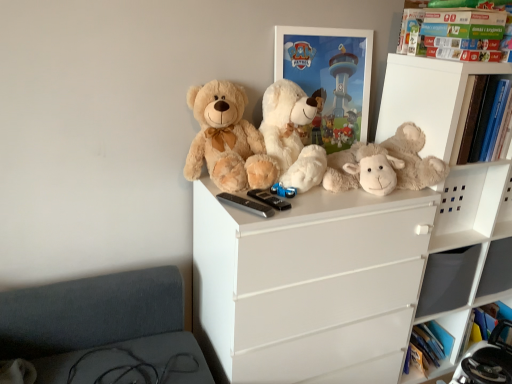
What do you see at coordinates (291, 135) in the screenshot? Image resolution: width=512 pixels, height=384 pixels. I see `fluffy white teddy bear at upper center, which is the second teddy bear in left-to-right order` at bounding box center [291, 135].

Describe the element at coordinates (449, 24) in the screenshot. I see `green cardboard book at upper right` at that location.

Describe the element at coordinates (329, 78) in the screenshot. I see `white glossy picture frame at upper center` at that location.

What is the approximate height of fluffy beige teddy bear at center, placed as the 1th teddy bear when sorted from right to left?

9.05 inches.

In order to click on white matte shelf at upper right in this screenshot , I will do click(426, 98).

The width and height of the screenshot is (512, 384). Identify the location of fluffy white teddy bear at upper center, the 2th teddy bear positioned from the right. (291, 135).

Who is bigger, fluffy beige teddy bear at center, marked as the 3th teddy bear in a left-to-right arrangement, or green cardboard book at upper right?

With larger size is fluffy beige teddy bear at center, marked as the 3th teddy bear in a left-to-right arrangement.

How far apart are fluffy beige teddy bear at center, placed as the 1th teddy bear when sorted from right to left, and green cardboard book at upper right?

16.93 inches.

Can we say fluffy beige teddy bear at center, marked as the 3th teddy bear in a left-to-right arrangement, lies outside green cardboard book at upper right?

fluffy beige teddy bear at center, marked as the 3th teddy bear in a left-to-right arrangement, lies outside green cardboard book at upper right's area.

How many degrees apart are the facing directions of fluffy beige teddy bear at center, marked as the 3th teddy bear in a left-to-right arrangement, and green cardboard book at upper right?

They differ by 1.41 degrees in their facing directions.

Which is farther from the camera, (269, 151) or (384, 85)?

The point (384, 85) is farther from the camera.

From their relative heights in the image, would you say fluffy white teddy bear at upper center, the 2th teddy bear positioned from the right, is taller or shorter than white matte shelf at upper right?

fluffy white teddy bear at upper center, the 2th teddy bear positioned from the right, is taller than white matte shelf at upper right.

From the image's perspective, is fluffy white teddy bear at upper center, which is the second teddy bear in left-to-right order, below white matte shelf at upper right?

Yes, from the image's perspective, fluffy white teddy bear at upper center, which is the second teddy bear in left-to-right order, is beneath white matte shelf at upper right.

Does fluffy white teddy bear at upper center, which is the second teddy bear in left-to-right order, have a lesser width compared to white matte shelf at upper right?

Correct, the width of fluffy white teddy bear at upper center, which is the second teddy bear in left-to-right order, is less than that of white matte shelf at upper right.

This screenshot has width=512, height=384. I want to click on picture frame on the left side of green cardboard book at upper right, so click(329, 78).

Considering the sizes of white glossy picture frame at upper center and green cardboard book at upper right in the image, is white glossy picture frame at upper center wider or thinner than green cardboard book at upper right?

Considering their sizes, white glossy picture frame at upper center looks slimmer than green cardboard book at upper right.

Which of these two, white glossy picture frame at upper center or green cardboard book at upper right, stands shorter?

Standing shorter between the two is green cardboard book at upper right.

From a real-world perspective, which is physically above, white glossy picture frame at upper center or green cardboard book at upper right?

In real-world perspective, green cardboard book at upper right is above.

Is white glossy picture frame at upper center positioned in front of fluffy beige teddy bear at upper center, the 3th teddy bear from the right?

No, white glossy picture frame at upper center is further to the viewer.

Is white glossy picture frame at upper center in contact with fluffy beige teddy bear at upper center, the 3th teddy bear from the right?

No, white glossy picture frame at upper center is not beside fluffy beige teddy bear at upper center, the 3th teddy bear from the right.

In terms of size, does white glossy picture frame at upper center appear bigger or smaller than fluffy beige teddy bear at upper center, which appears as the first teddy bear when viewed from the left?

Considering their sizes, white glossy picture frame at upper center takes up less space than fluffy beige teddy bear at upper center, which appears as the first teddy bear when viewed from the left.

Is white glossy picture frame at upper center facing towards fluffy beige teddy bear at upper center, which appears as the first teddy bear when viewed from the left?

No, white glossy picture frame at upper center does not turn towards fluffy beige teddy bear at upper center, which appears as the first teddy bear when viewed from the left.

Is fluffy beige teddy bear at upper center, the 3th teddy bear from the right, at the back of green cardboard book at upper right?

No, green cardboard book at upper right is not facing the opposite direction of fluffy beige teddy bear at upper center, the 3th teddy bear from the right.

Looking at this image, looking at their sizes, would you say green cardboard book at upper right is wider or thinner than fluffy beige teddy bear at upper center, which appears as the first teddy bear when viewed from the left?

green cardboard book at upper right is thinner than fluffy beige teddy bear at upper center, which appears as the first teddy bear when viewed from the left.

In the scene shown: Are green cardboard book at upper right and fluffy beige teddy bear at upper center, which appears as the first teddy bear when viewed from the left, located far from each other?

green cardboard book at upper right is near fluffy beige teddy bear at upper center, which appears as the first teddy bear when viewed from the left, not far away.

Do you think fluffy beige teddy bear at upper center, which appears as the first teddy bear when viewed from the left, is within fluffy beige teddy bear at center, marked as the 3th teddy bear in a left-to-right arrangement, or outside of it?

fluffy beige teddy bear at upper center, which appears as the first teddy bear when viewed from the left, cannot be found inside fluffy beige teddy bear at center, marked as the 3th teddy bear in a left-to-right arrangement.

Based on the photo, can you confirm if fluffy beige teddy bear at upper center, which appears as the first teddy bear when viewed from the left, is thinner than fluffy beige teddy bear at center, placed as the 1th teddy bear when sorted from right to left?

Indeed, fluffy beige teddy bear at upper center, which appears as the first teddy bear when viewed from the left, has a lesser width compared to fluffy beige teddy bear at center, placed as the 1th teddy bear when sorted from right to left.

Does fluffy beige teddy bear at upper center, the 3th teddy bear from the right, appear on the left side of fluffy beige teddy bear at center, marked as the 3th teddy bear in a left-to-right arrangement?

Yes.

Identify the location of teddy bear below the fluffy beige teddy bear at upper center, the 3th teddy bear from the right (from the image's perspective). (385, 165).

Is fluffy beige teddy bear at upper center, which appears as the first teddy bear when viewed from the left, positioned far away from white glossy picture frame at upper center?

fluffy beige teddy bear at upper center, which appears as the first teddy bear when viewed from the left, is actually quite close to white glossy picture frame at upper center.

Considering the positions of objects fluffy beige teddy bear at upper center, the 3th teddy bear from the right, and white glossy picture frame at upper center in the image provided, who is behind, fluffy beige teddy bear at upper center, the 3th teddy bear from the right, or white glossy picture frame at upper center?

Positioned behind is white glossy picture frame at upper center.

In terms of size, does fluffy beige teddy bear at upper center, the 3th teddy bear from the right, appear bigger or smaller than white glossy picture frame at upper center?

In the image, fluffy beige teddy bear at upper center, the 3th teddy bear from the right, appears to be larger than white glossy picture frame at upper center.

In order to click on the 1st teddy bear in front when counting from the green cardboard book at upper right in this screenshot , I will do `click(385, 165)`.

This screenshot has height=384, width=512. Find the location of `the 1st teddy bear positioned below the white matte shelf at upper right (from a real-world perspective)`. the 1st teddy bear positioned below the white matte shelf at upper right (from a real-world perspective) is located at coordinates pos(291,135).

In the scene shown: Based on their spatial positions, is white glossy picture frame at upper center or green cardboard book at upper right closer to fluffy beige teddy bear at center, marked as the 3th teddy bear in a left-to-right arrangement?

Based on the image, white glossy picture frame at upper center appears to be nearer to fluffy beige teddy bear at center, marked as the 3th teddy bear in a left-to-right arrangement.

Based on their spatial positions, is white glossy picture frame at upper center or fluffy beige teddy bear at upper center, the 3th teddy bear from the right, closer to fluffy beige teddy bear at center, marked as the 3th teddy bear in a left-to-right arrangement?

white glossy picture frame at upper center lies closer to fluffy beige teddy bear at center, marked as the 3th teddy bear in a left-to-right arrangement, than the other object.

Considering their positions, is green cardboard book at upper right positioned closer to white glossy picture frame at upper center than fluffy beige teddy bear at center, marked as the 3th teddy bear in a left-to-right arrangement?

Based on the image, fluffy beige teddy bear at center, marked as the 3th teddy bear in a left-to-right arrangement, appears to be nearer to white glossy picture frame at upper center.

Estimate the real-world distances between objects in this image. Which object is closer to white glossy picture frame at upper center, fluffy beige teddy bear at center, marked as the 3th teddy bear in a left-to-right arrangement, or white matte shelf at upper right?

Based on the image, white matte shelf at upper right appears to be nearer to white glossy picture frame at upper center.

Estimate the real-world distances between objects in this image. Which object is further from fluffy beige teddy bear at center, marked as the 3th teddy bear in a left-to-right arrangement, green cardboard book at upper right or white glossy picture frame at upper center?

green cardboard book at upper right is further to fluffy beige teddy bear at center, marked as the 3th teddy bear in a left-to-right arrangement.

Considering their positions, is white matte shelf at upper right positioned further to fluffy beige teddy bear at upper center, which appears as the first teddy bear when viewed from the left, than green cardboard book at upper right?

green cardboard book at upper right lies further to fluffy beige teddy bear at upper center, which appears as the first teddy bear when viewed from the left, than the other object.

From the picture: Considering their positions, is white glossy picture frame at upper center positioned closer to green cardboard book at upper right than fluffy beige teddy bear at upper center, which appears as the first teddy bear when viewed from the left?

Among the two, white glossy picture frame at upper center is located nearer to green cardboard book at upper right.

Estimate the real-world distances between objects in this image. Which object is further from fluffy beige teddy bear at upper center, the 3th teddy bear from the right, fluffy white teddy bear at upper center, which is the second teddy bear in left-to-right order, or white glossy picture frame at upper center?

white glossy picture frame at upper center lies further to fluffy beige teddy bear at upper center, the 3th teddy bear from the right, than the other object.

Identify the location of teddy bear between fluffy white teddy bear at upper center, which is the second teddy bear in left-to-right order, and green cardboard book at upper right, in the horizontal direction. (385, 165).

The image size is (512, 384). I want to click on teddy bear located between fluffy white teddy bear at upper center, the 2th teddy bear positioned from the right, and white matte shelf at upper right in the left-right direction, so click(385, 165).

Where is `teddy bear located between white glossy picture frame at upper center and green cardboard book at upper right in the left-right direction`? teddy bear located between white glossy picture frame at upper center and green cardboard book at upper right in the left-right direction is located at coordinates (385, 165).

You are a GUI agent. You are given a task and a screenshot of the screen. Output one action in this format:
    pyautogui.click(x=<x>, y=<y>)
    Task: Click on the book located between white glossy picture frame at upper center and white matte shelf at upper right in the left-right direction
    The width and height of the screenshot is (512, 384).
    Given the screenshot: What is the action you would take?
    pyautogui.click(x=449, y=24)